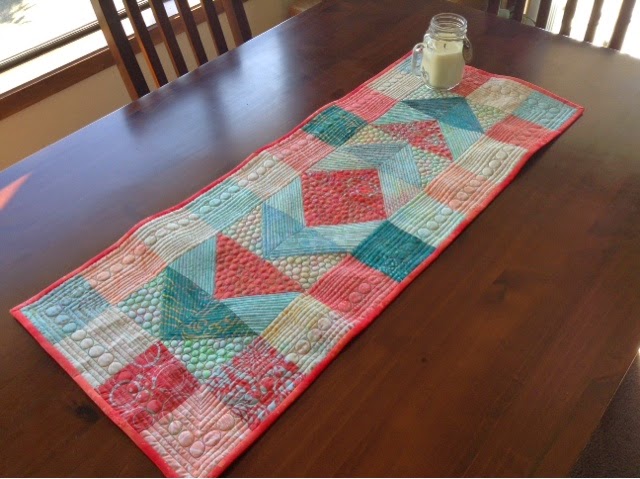
Where is `quilt`? Image resolution: width=640 pixels, height=479 pixels. quilt is located at coordinates (230, 310).